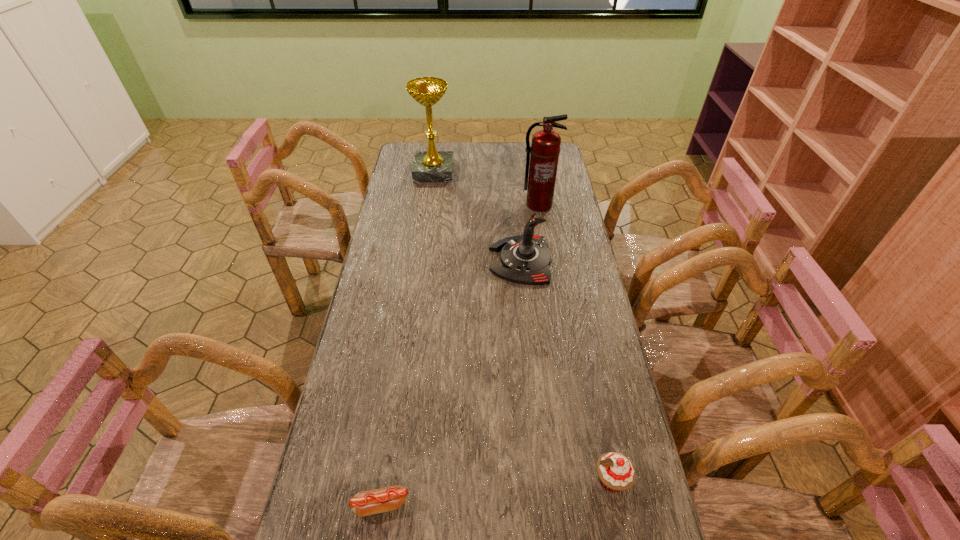
Where is `vacant area that lies between the fire extinguisher and the sausage`? The height and width of the screenshot is (540, 960). vacant area that lies between the fire extinguisher and the sausage is located at coordinates (460, 355).

Where is `vacant space that is in between the shortest object and the second shortest object`? vacant space that is in between the shortest object and the second shortest object is located at coordinates (496, 492).

The width and height of the screenshot is (960, 540). In order to click on empty space between the fourth tallest object and the sausage in this screenshot , I will do `click(496, 492)`.

Identify which object is the closest to the second farthest object. Please provide its 2D coordinates. Your answer should be formatted as a tuple, i.e. [(x, y)], where the tuple contains the x and y coordinates of a point satisfying the conditions above.

[(525, 259)]

Where is `object that can be found as the third closest to the award`? Image resolution: width=960 pixels, height=540 pixels. object that can be found as the third closest to the award is located at coordinates (616, 472).

This screenshot has width=960, height=540. What are the coordinates of `free space in the image that satisfies the following two spatial constraints: 1. on the front-facing side of the farthest object; 2. on the front side of the sausage` in the screenshot? It's located at (388, 505).

Locate an element on the screen. vacant position in the image that satisfies the following two spatial constraints: 1. on the front-facing side of the award; 2. on the front side of the sausage is located at coordinates (388, 505).

Where is `free space that satisfies the following two spatial constraints: 1. on the handle side of the fourth tallest object; 2. on the left side of the joystick`? The image size is (960, 540). free space that satisfies the following two spatial constraints: 1. on the handle side of the fourth tallest object; 2. on the left side of the joystick is located at coordinates pyautogui.click(x=541, y=480).

Identify the location of vacant space that satisfies the following two spatial constraints: 1. on the side of the fire extinguisher with the handle and hose; 2. on the handle side of the joystick. Image resolution: width=960 pixels, height=540 pixels. (547, 260).

The width and height of the screenshot is (960, 540). Identify the location of vacant region that satisfies the following two spatial constraints: 1. on the handle side of the third tallest object; 2. on the back side of the second shortest object. (541, 480).